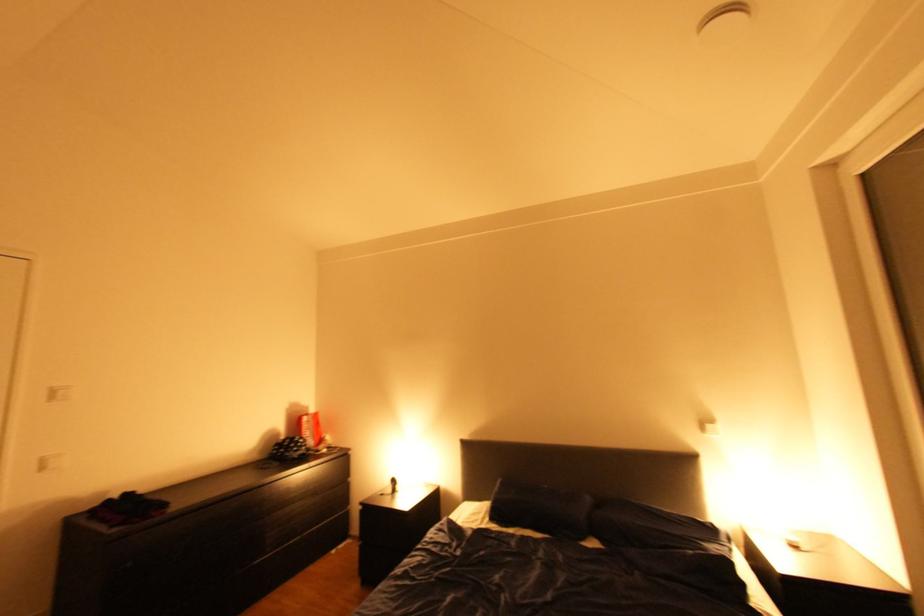
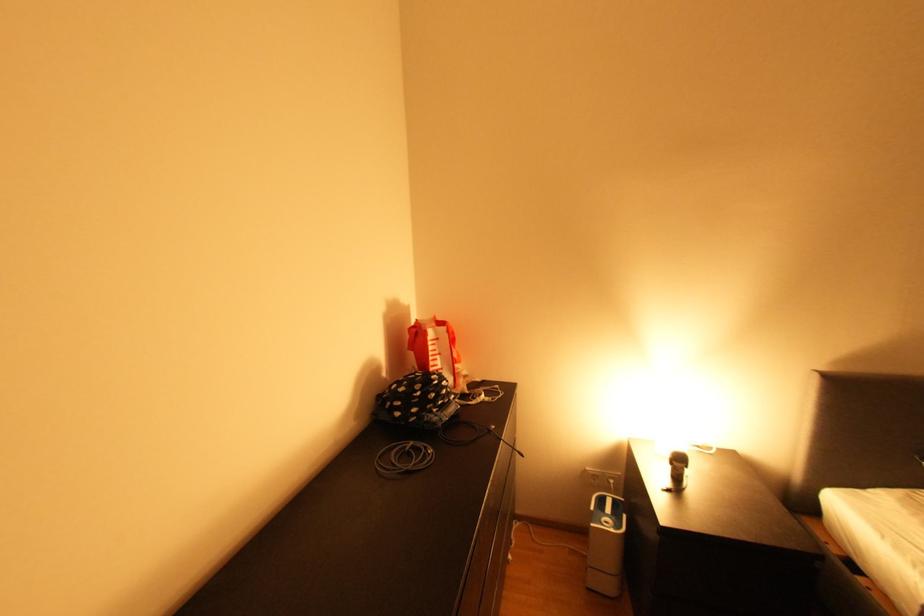
Locate, in the second image, the point that corresponds to [299,452] in the first image.

(441, 411)